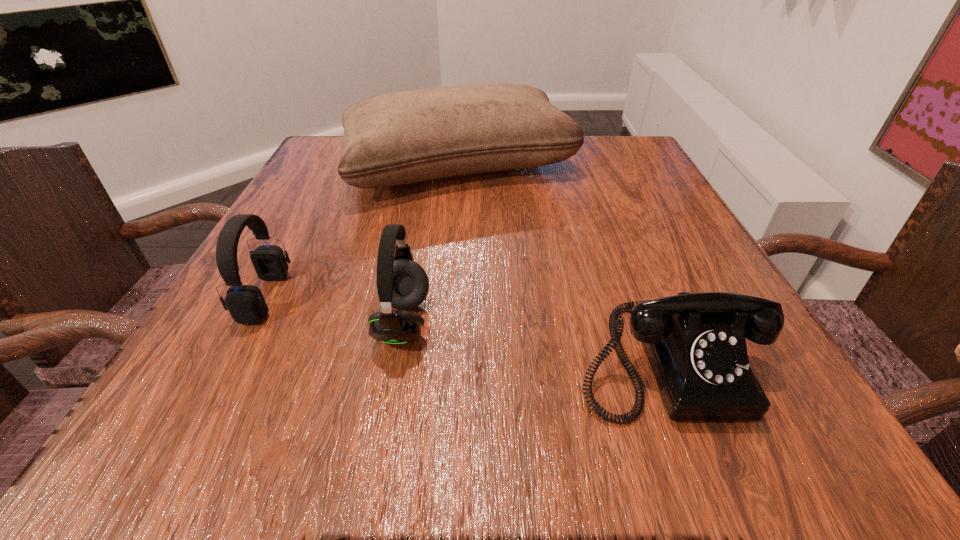
At what (x,y) coordinates should I click in order to perform the action: click on object that is the second closest one to the right headset. Please return your answer as a coordinate pair (x, y). This screenshot has width=960, height=540. Looking at the image, I should click on (696, 345).

Locate an element on the screen. free space that satisfies the following two spatial constraints: 1. on the front side of the farthest object; 2. on the ear cups of the right headset is located at coordinates (449, 322).